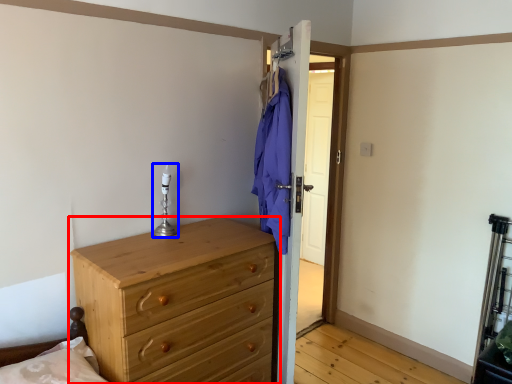
Question: Which object is closer to the camera taking this photo, chest of drawers (highlighted by a red box) or candle holder (highlighted by a blue box)?

Choices:
 (A) chest of drawers
 (B) candle holder

Answer: (A)